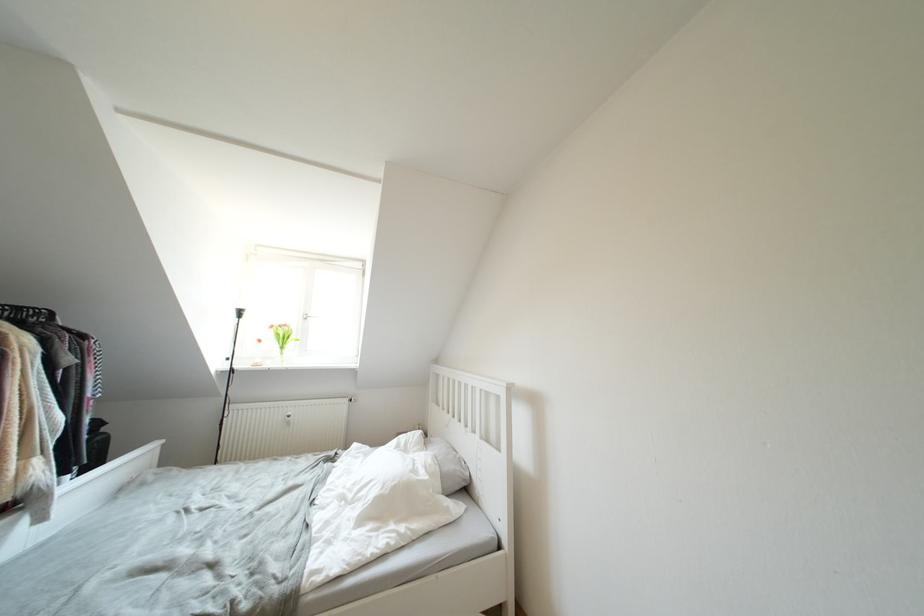
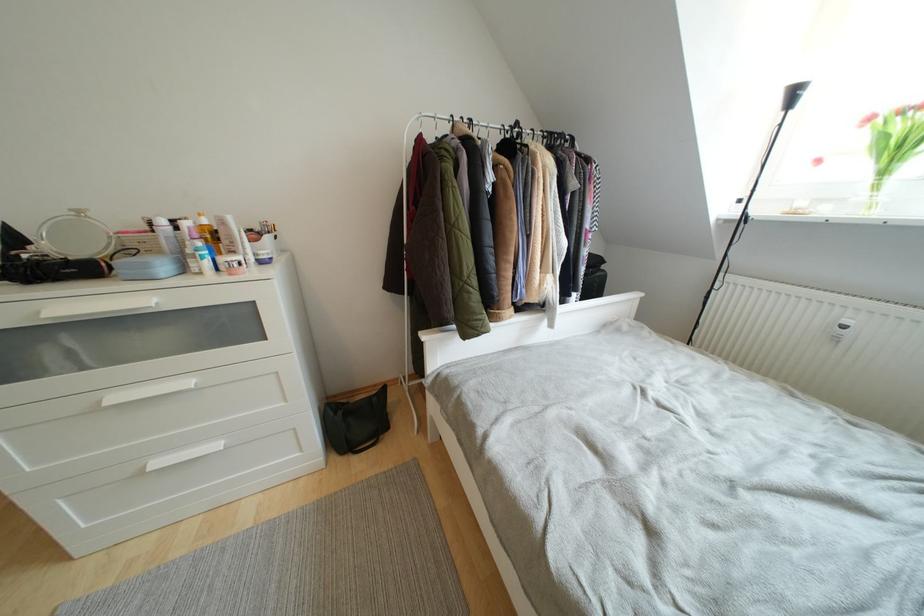
The point at (295, 416) is marked in the first image. Where is the corresponding point in the second image?

(853, 326)